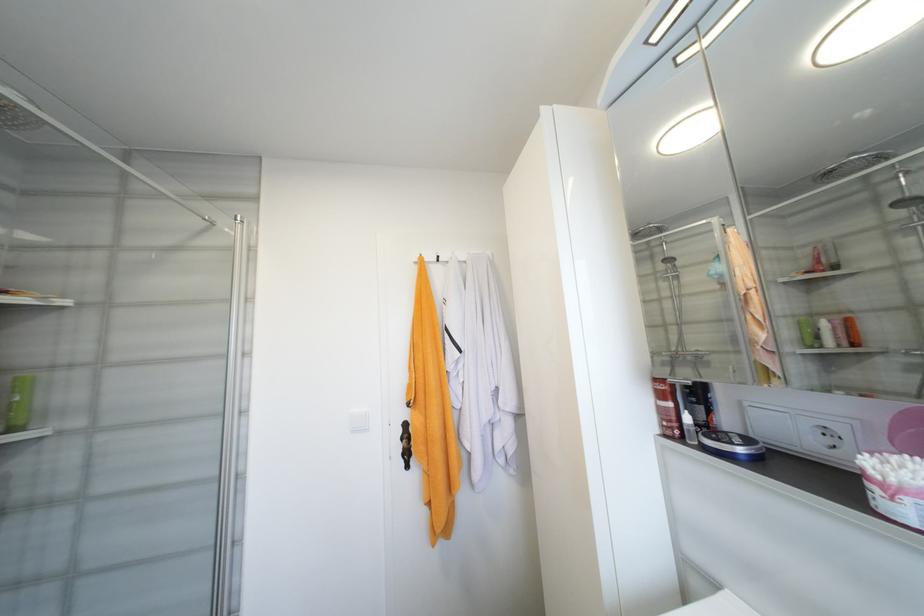
I want to click on white light switch, so click(359, 419).